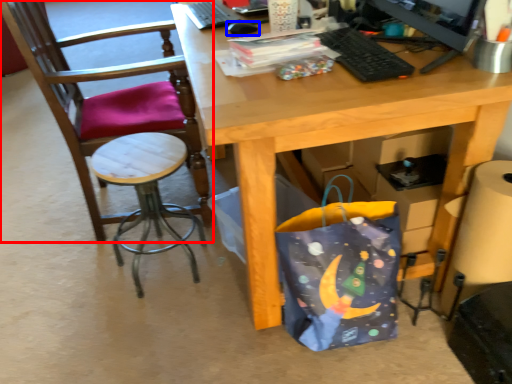
Question: Which object appears closest to the camera in this image, chair (highlighted by a red box) or mouse (highlighted by a blue box)?

Choices:
 (A) chair
 (B) mouse

Answer: (A)